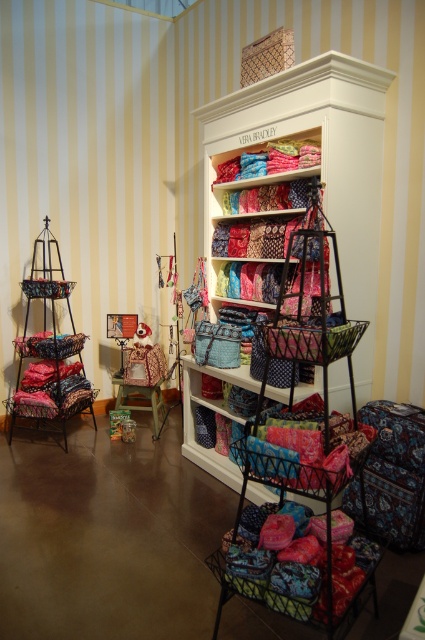
Question: Which object appears farthest from the camera in this image?

Choices:
 (A) metallic wire basket at left
 (B) wooden stool at center

Answer: (B)

Question: Among these points, which one is nearest to the camera?

Choices:
 (A) (78, 400)
 (B) (119, 380)

Answer: (B)

Question: Is metallic wire basket at left below wooden stool at center?

Choices:
 (A) yes
 (B) no

Answer: (B)

Question: Can you confirm if metallic wire basket at left is positioned to the right of wooden stool at center?

Choices:
 (A) yes
 (B) no

Answer: (B)

Question: Can you confirm if metallic wire basket at left is positioned above wooden stool at center?

Choices:
 (A) no
 (B) yes

Answer: (B)